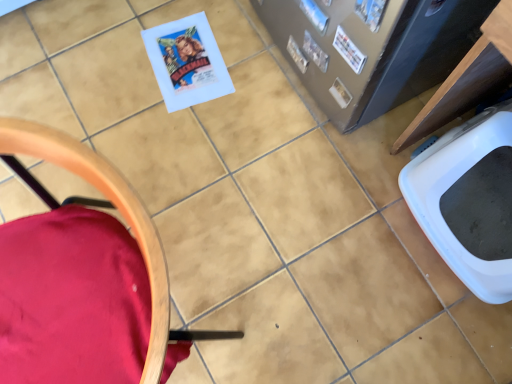
Question: Does point (424, 188) appear closer or farther from the camera than point (369, 11)?

Choices:
 (A) farther
 (B) closer

Answer: (A)

Question: Would you say white plastic toilet bowl at lower right is to the left or to the right of matte paper comic book at upper right, acting as the 1th comic book starting from the front, in the picture?

Choices:
 (A) right
 (B) left

Answer: (A)

Question: Estimate the real-world distances between objects in this image. Which object is farther from the white plastic toilet bowl at lower right?

Choices:
 (A) blue glossy comic book at upper right, the 3th comic book viewed from the front
 (B) white paper comic book at upper right, which appears as the second comic book when viewed from the front
 (C) velvet red chair at lower left
 (D) matte paper comic book at upper right, acting as the 1th comic book starting from the front

Answer: (C)

Question: Considering the real-world distances, which object is closest to the matte paper comic book at upper right, the third comic book from the back?

Choices:
 (A) blue glossy comic book at upper right, positioned as the first comic book in back-to-front order
 (B) velvet red chair at lower left
 (C) white paper comic book at upper right, the 2th comic book positioned from the back
 (D) white plastic toilet bowl at lower right

Answer: (C)